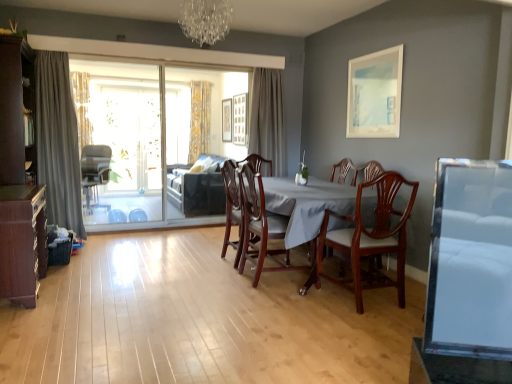
Question: Is gray fabric curtain at center, the 2th curtain when ordered from front to back, facing towards mahogany wood chair at center, which is the fourth chair from left to right?

Choices:
 (A) no
 (B) yes

Answer: (B)

Question: Is the position of gray fabric curtain at center, the 4th curtain when ordered from left to right, less distant than that of mahogany wood chair at center, the first chair positioned from the front?

Choices:
 (A) no
 (B) yes

Answer: (A)

Question: Is gray fabric curtain at center, which is counted as the 3th curtain, starting from the back, placed right next to mahogany wood chair at center, the first chair when ordered from right to left?

Choices:
 (A) yes
 (B) no

Answer: (B)

Question: Does gray fabric curtain at center, which is counted as the 3th curtain, starting from the back, have a lesser height compared to mahogany wood chair at center, the first chair when ordered from right to left?

Choices:
 (A) no
 (B) yes

Answer: (A)

Question: Can you confirm if gray fabric curtain at center, which is counted as the 3th curtain, starting from the back, is bigger than mahogany wood chair at center, the first chair when ordered from right to left?

Choices:
 (A) yes
 (B) no

Answer: (B)

Question: From a real-world perspective, is wooden cabinet at lower left beneath wooden picture frame at upper center, the 1th picture frame in the left-to-right sequence?

Choices:
 (A) yes
 (B) no

Answer: (A)

Question: Would you consider wooden cabinet at lower left to be distant from wooden picture frame at upper center, the 1th picture frame in the left-to-right sequence?

Choices:
 (A) yes
 (B) no

Answer: (A)

Question: Considering the relative sizes of wooden cabinet at lower left and wooden picture frame at upper center, which is the 3th picture frame in front-to-back order, in the image provided, is wooden cabinet at lower left thinner than wooden picture frame at upper center, which is the 3th picture frame in front-to-back order,?

Choices:
 (A) yes
 (B) no

Answer: (B)

Question: Is the depth of wooden cabinet at lower left less than that of wooden picture frame at upper center, the 1th picture frame in the left-to-right sequence?

Choices:
 (A) yes
 (B) no

Answer: (A)

Question: Is wooden picture frame at upper center, the first picture frame from the back, surrounded by wooden cabinet at lower left?

Choices:
 (A) no
 (B) yes

Answer: (A)

Question: Is wooden cabinet at lower left at the left side of wooden picture frame at upper center, which is the 3th picture frame in front-to-back order?

Choices:
 (A) no
 (B) yes

Answer: (B)

Question: From the image's perspective, would you say mahogany wood table at center is shown under mahogany wood dining chair at center, the 3th chair in the left-to-right sequence?

Choices:
 (A) no
 (B) yes

Answer: (B)